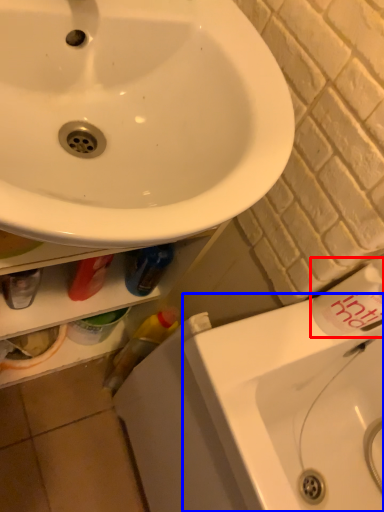
Question: Which point is further to the camera, toiletry (highlighted by a red box) or counter top (highlighted by a blue box)?

Choices:
 (A) toiletry
 (B) counter top

Answer: (A)